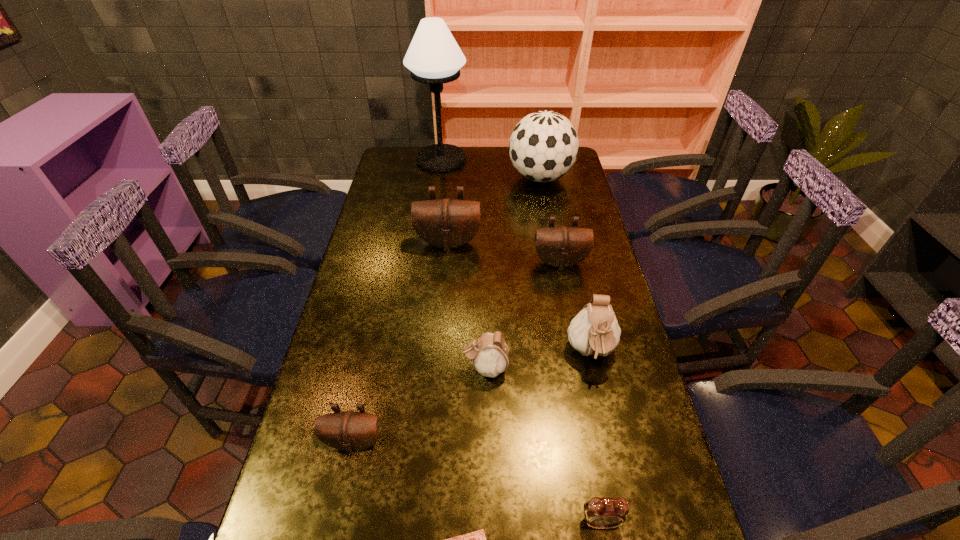
The image size is (960, 540). I want to click on alarm clock, so click(x=602, y=513).

Find the location of a particular element. This screenshot has width=960, height=540. free space located 0.080m on the front of the table lamp is located at coordinates (438, 184).

This screenshot has height=540, width=960. I want to click on vacant area situated on the left of the black soccer ball, so click(436, 178).

Identify the location of free spot located 0.100m with the flap open on the biggest brown pouch. The image size is (960, 540). (445, 274).

You are a GUI agent. You are given a task and a screenshot of the screen. Output one action in this format:
    pyautogui.click(x=<x>, y=<y>)
    Task: Click on the free spot located on the front-facing side of the bigger white pouch
    This screenshot has height=540, width=960.
    Given the screenshot: What is the action you would take?
    pyautogui.click(x=614, y=459)

You are a GUI agent. You are given a task and a screenshot of the screen. Output one action in this format:
    pyautogui.click(x=<x>, y=<y>)
    Task: Click on the vacant space located 0.180m with the flap open on the second smallest brown pouch
    The width and height of the screenshot is (960, 540).
    Given the screenshot: What is the action you would take?
    pyautogui.click(x=570, y=314)

What are the coordinates of `vacant space located on the front-facing side of the smaller white pouch` in the screenshot? It's located at (337, 368).

Where is `free region located on the front-facing side of the smaller white pouch`? This screenshot has width=960, height=540. free region located on the front-facing side of the smaller white pouch is located at coordinates (427, 368).

The image size is (960, 540). I want to click on vacant region located 0.320m on the front-facing side of the smaller white pouch, so click(x=341, y=368).

Locate an element on the screen. The height and width of the screenshot is (540, 960). vacant space located 0.080m with the flap open on the nearest pouch is located at coordinates (344, 495).